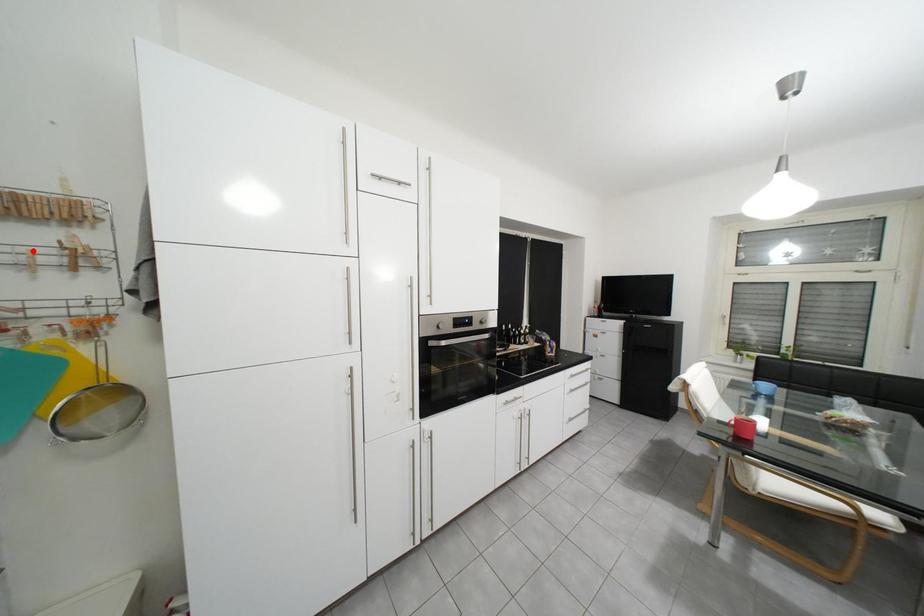
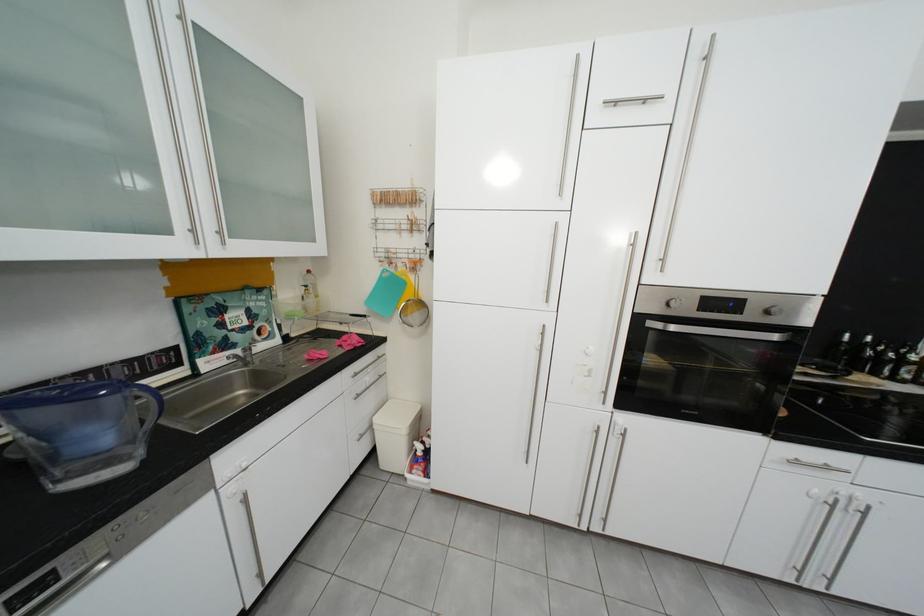
Question: A red point is marked in image1. In image2, is the corresponding 3D point closer to the camera or farther? Reply with the corresponding letter.

Choices:
 (A) The corresponding 3D point is closer.
 (B) The corresponding 3D point is farther.

Answer: (A)